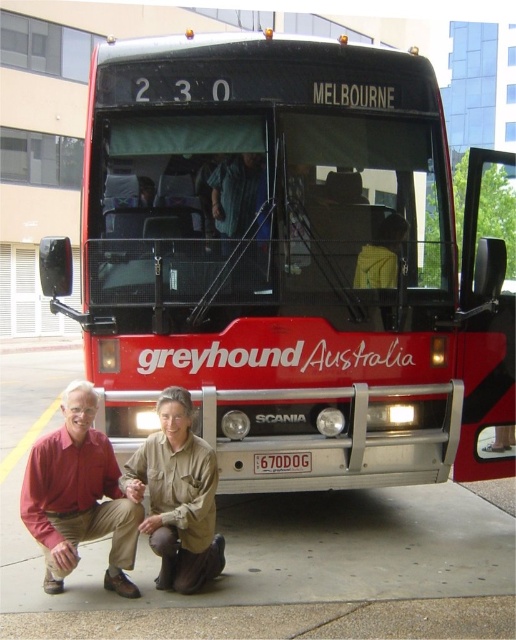
You are standing on the gray concrete pavement at lower center and want to take a photo of the metallic red bus at center. In which direction should you move to frame the bus properly?

The metallic red bus at center is to the right of gray concrete pavement at lower center, so you should move to your right to frame the bus properly.

You are a delivery person with a cart that is 6 feet wide. You need to move from the gray concrete pavement at lower center to the metallic red bus at center. Can your cart fit through the space between them?

The metallic red bus at center and gray concrete pavement at lower center are 6.18 feet apart, so yes, the cart which is 6 feet wide can fit through the space between them since the distance is slightly larger than the cart width.